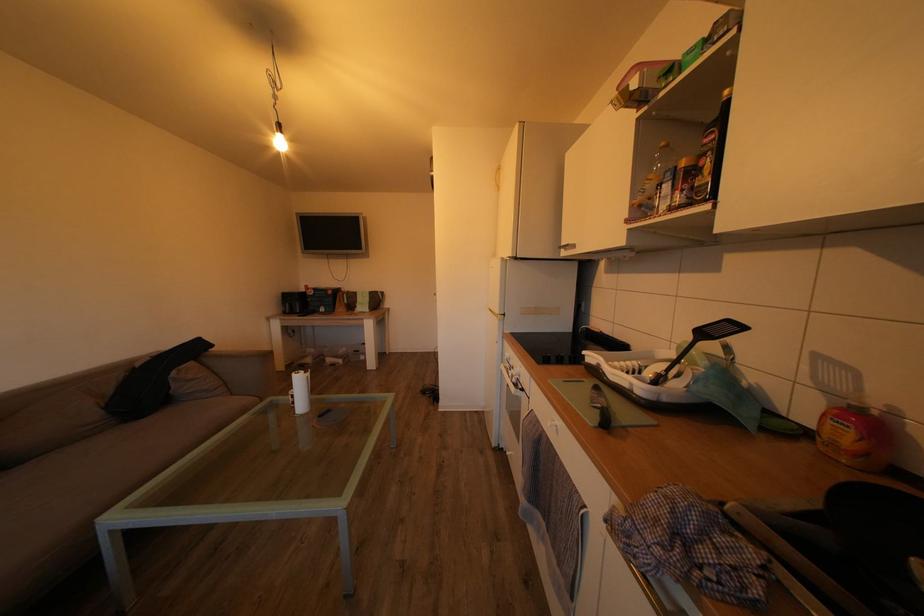
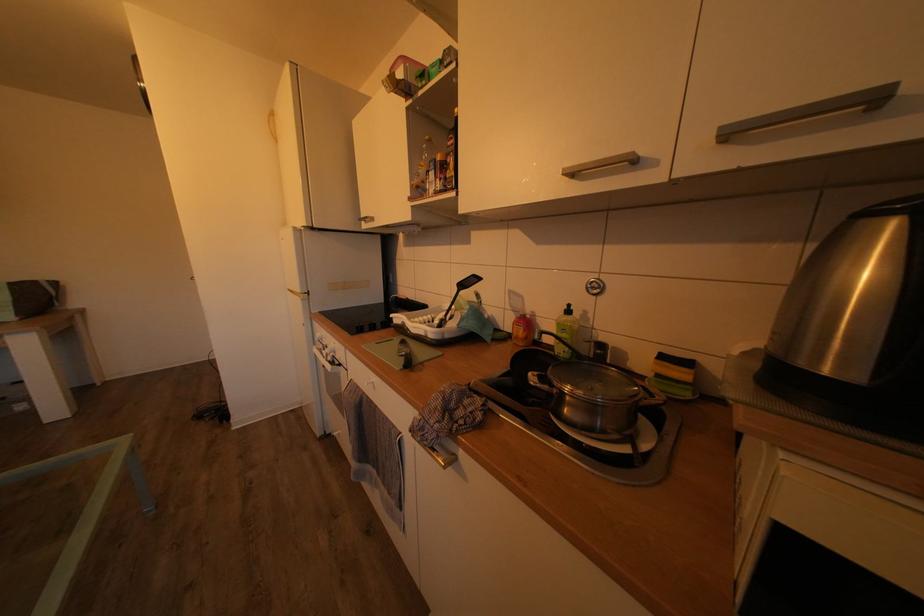
Question: The first image is from the beginning of the video and the second image is from the end. How did the camera likely rotate when shooting the video?

Choices:
 (A) Left
 (B) Right
 (C) Up
 (D) Down

Answer: (B)